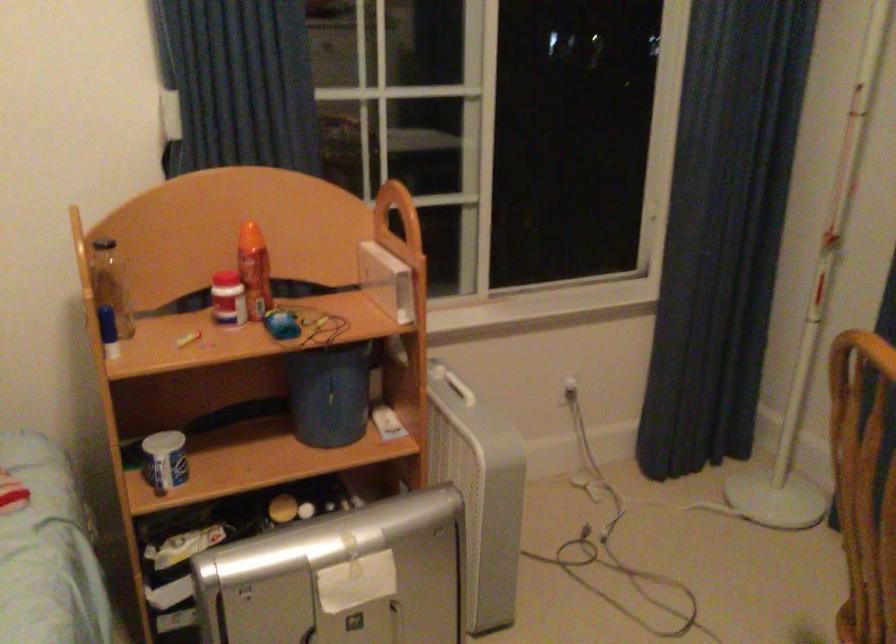
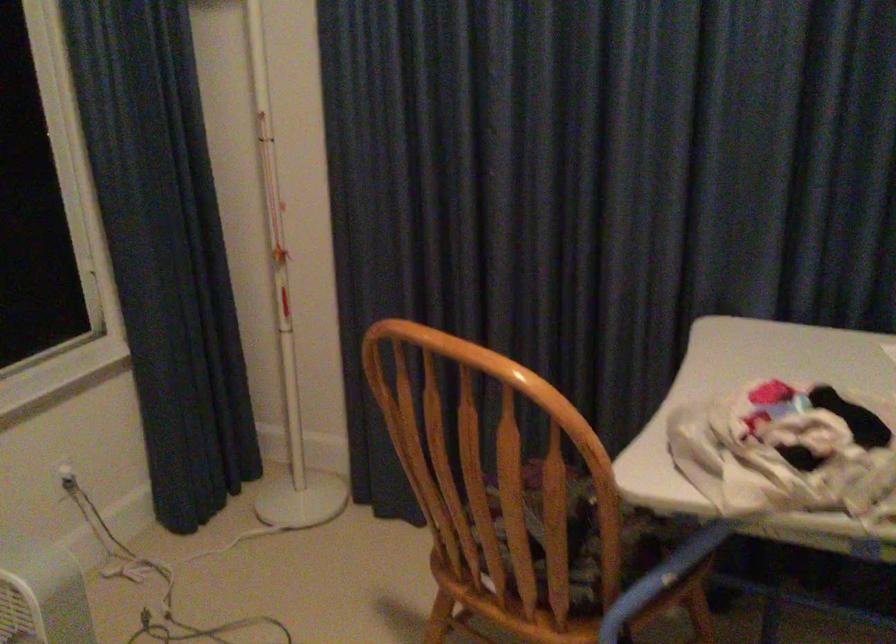
Question: The images are taken continuously from a first-person perspective. In which direction is your viewpoint rotating?

Choices:
 (A) Left
 (B) Right
 (C) Up
 (D) Down

Answer: (B)